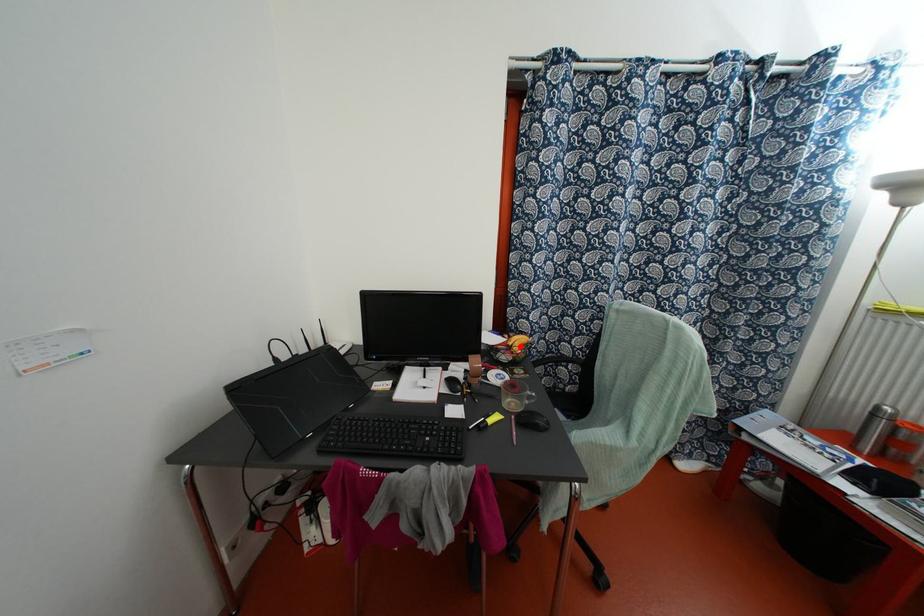
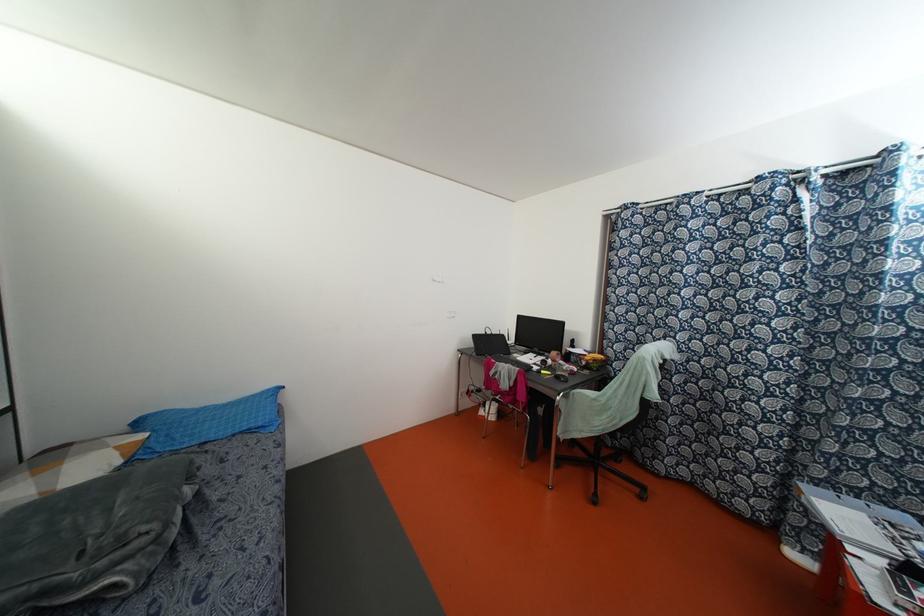
Where in the second image is the point corresponding to the highlighted location from the first image?

(593, 360)